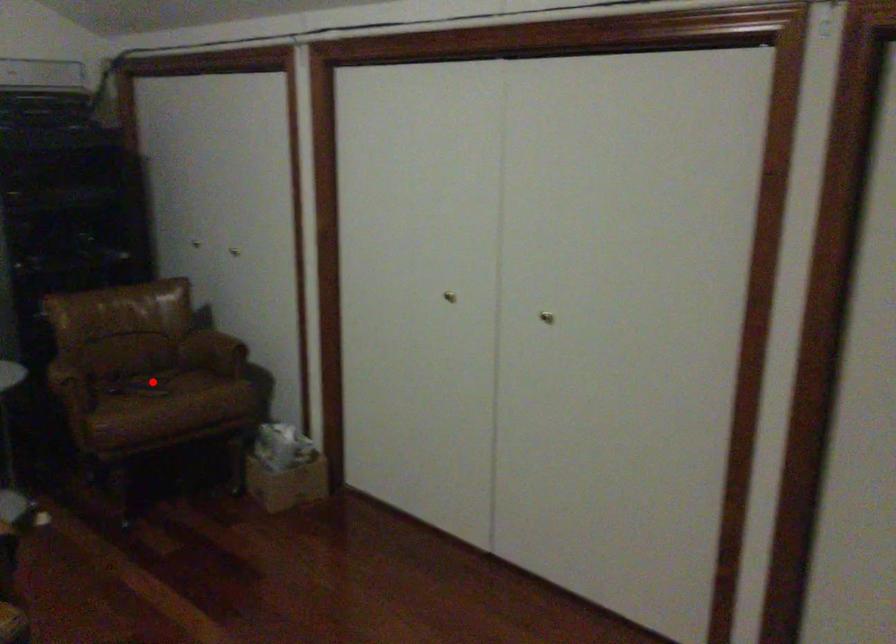
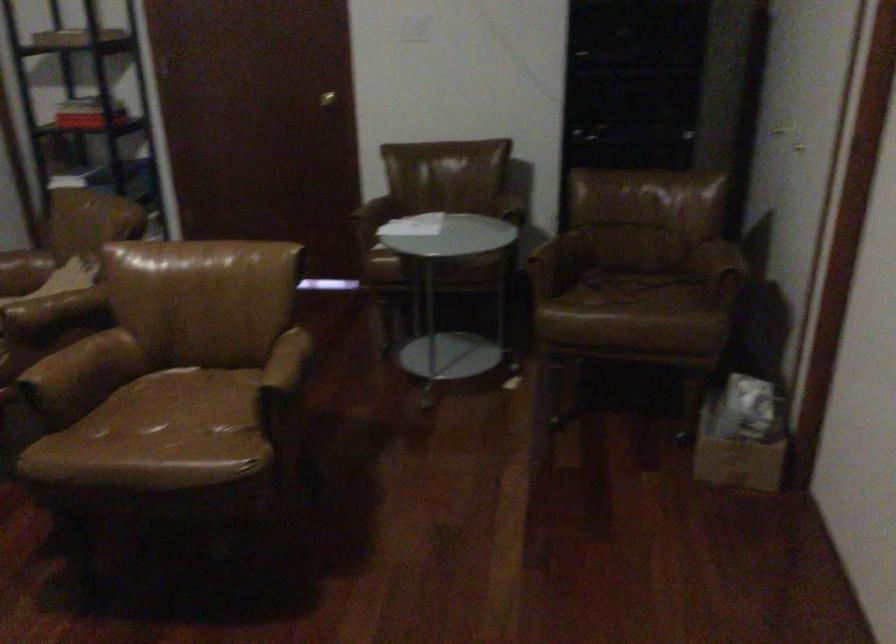
Question: I am providing you with two images of the same scene from different viewpoints. A red point is shown in image1. For the corresponding object point in image2, is it positioned nearer or farther from the camera?

Choices:
 (A) Nearer
 (B) Farther

Answer: (A)